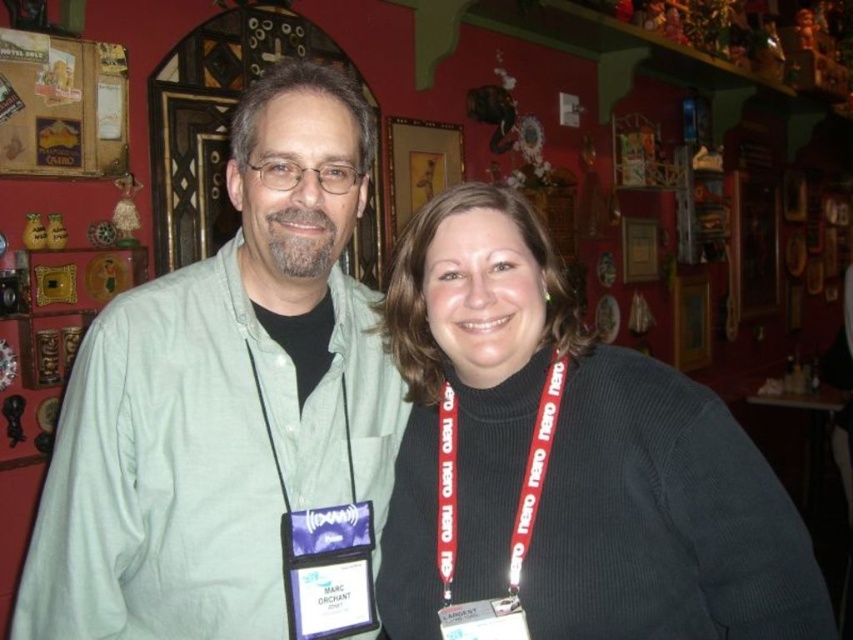
Question: Can you confirm if dark gray sweater at center is positioned above red fabric lanyard at center?

Choices:
 (A) yes
 (B) no

Answer: (B)

Question: Can you confirm if dark gray sweater at center is positioned to the right of black matte neck at center?

Choices:
 (A) no
 (B) yes

Answer: (B)

Question: Which point is closer to the camera?

Choices:
 (A) (323, 273)
 (B) (154, 573)
 (C) (534, 461)
 (D) (473, 376)

Answer: (C)

Question: Which object appears farthest from the camera in this image?

Choices:
 (A) black fabric neck at center
 (B) dark gray sweater at center
 (C) red fabric lanyard at center
 (D) black matte neck at center

Answer: (D)

Question: Which point is farther to the camera?

Choices:
 (A) (341, 554)
 (B) (773, 600)
 (C) (447, 609)
 (D) (486, 221)

Answer: (A)

Question: Considering the relative positions of green cotton shirt at left and black matte neck at center in the image provided, where is green cotton shirt at left located with respect to black matte neck at center?

Choices:
 (A) below
 (B) above

Answer: (A)